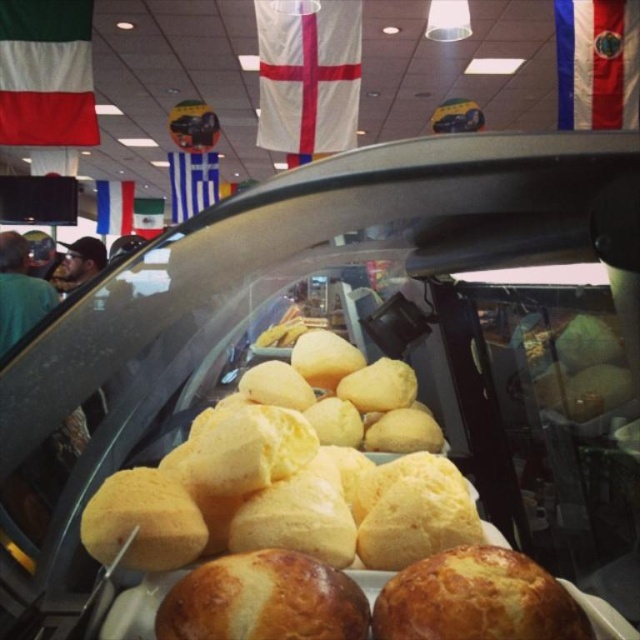
Question: Can you confirm if green fabric flag at upper left is positioned above green fabric flag at center?

Choices:
 (A) yes
 (B) no

Answer: (B)

Question: Which object is positioned farthest from the white fabric flag at upper center?

Choices:
 (A) green fabric flag at center
 (B) green fabric flag at upper left

Answer: (A)

Question: Which of the following is the closest to the observer?

Choices:
 (A) (333, 131)
 (B) (116, 232)

Answer: (A)

Question: Where is golden brown crusty bread at center located in relation to green fabric flag at upper left in the image?

Choices:
 (A) left
 (B) right

Answer: (B)

Question: In this image, where is white fabric flag at upper right located relative to bluematerial/textureflag at center?

Choices:
 (A) left
 (B) right

Answer: (B)

Question: Which point is farther to the camera?

Choices:
 (A) green fabric flag at center
 (B) white fabric flag at upper right
 (C) green fabric flag at upper left
 (D) blue fabric flag at upper left

Answer: (D)